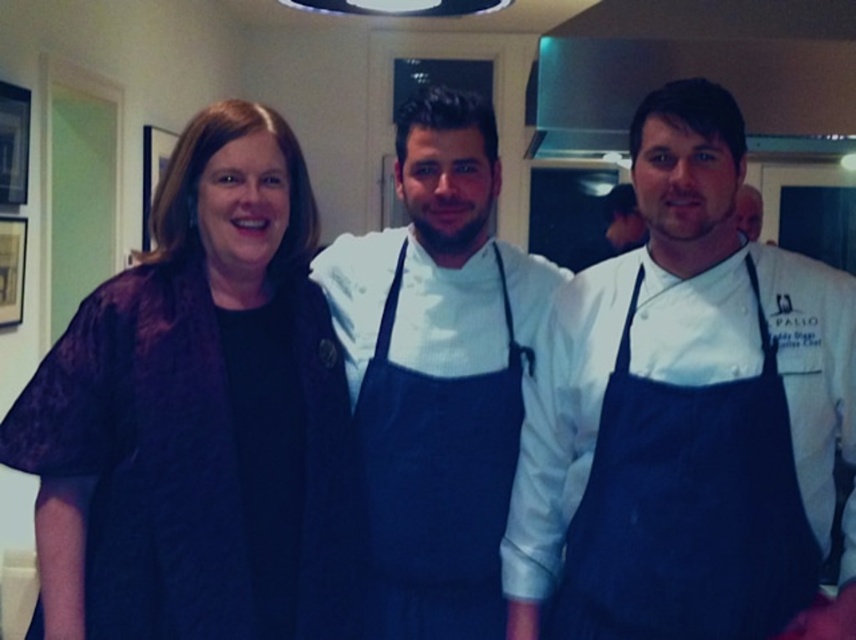
You are standing in the professional kitchen scene described. You need to move from point A at coordinates point (378,598) to point B at coordinates point (391,461). Which direction should you move to get closer to point B?

To move from point A at coordinates point (378,598) to point B at coordinates point (391,461), you should move backward because point A is closer to the viewer than point B.